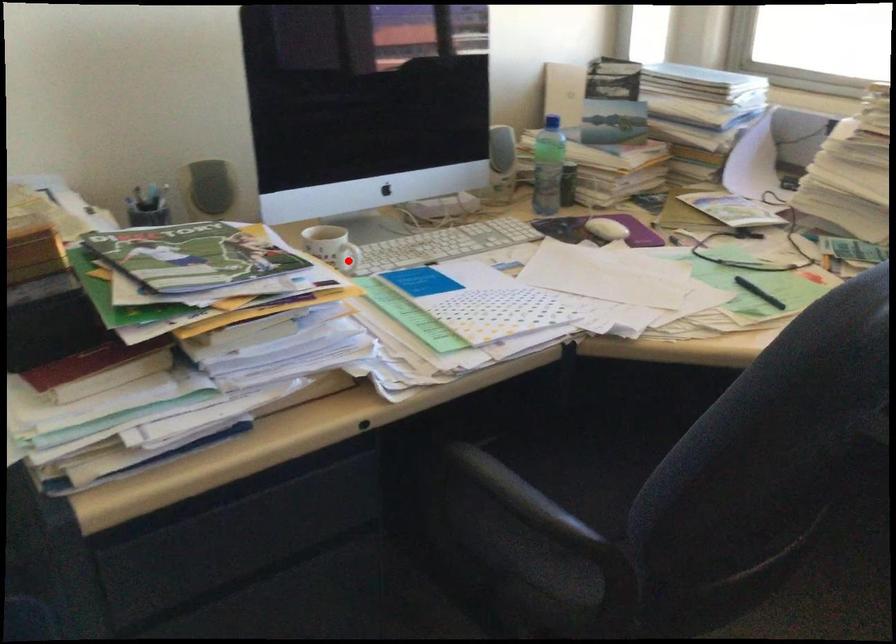
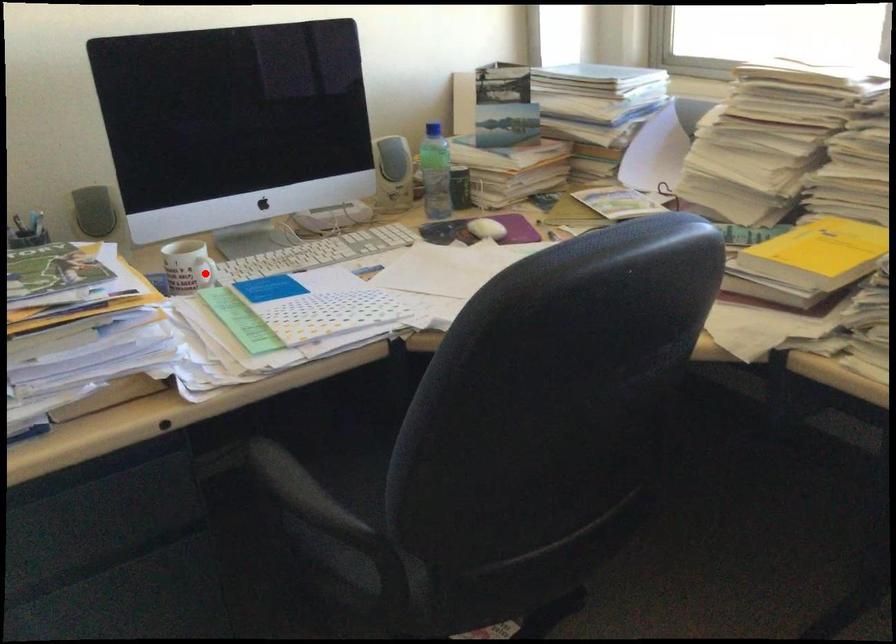
I am providing you with two images of the same scene from different viewpoints. A red point is marked on the first image and another point is marked on the second image. Does the point marked in image1 correspond to the same location as the one in image2?

Yes